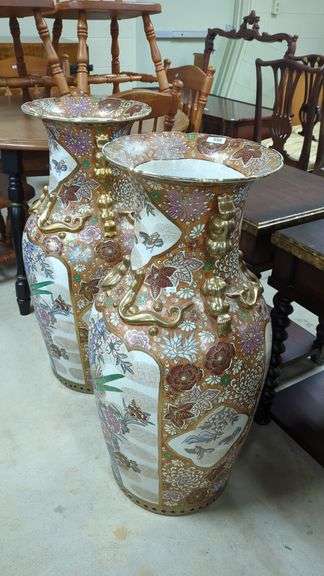
You are a GUI agent. You are given a task and a screenshot of the screen. Output one action in this format:
    pyautogui.click(x=<x>, y=<y>)
    Task: Click on the wall outlet
    
    Given the screenshot: What is the action you would take?
    pyautogui.click(x=274, y=7)